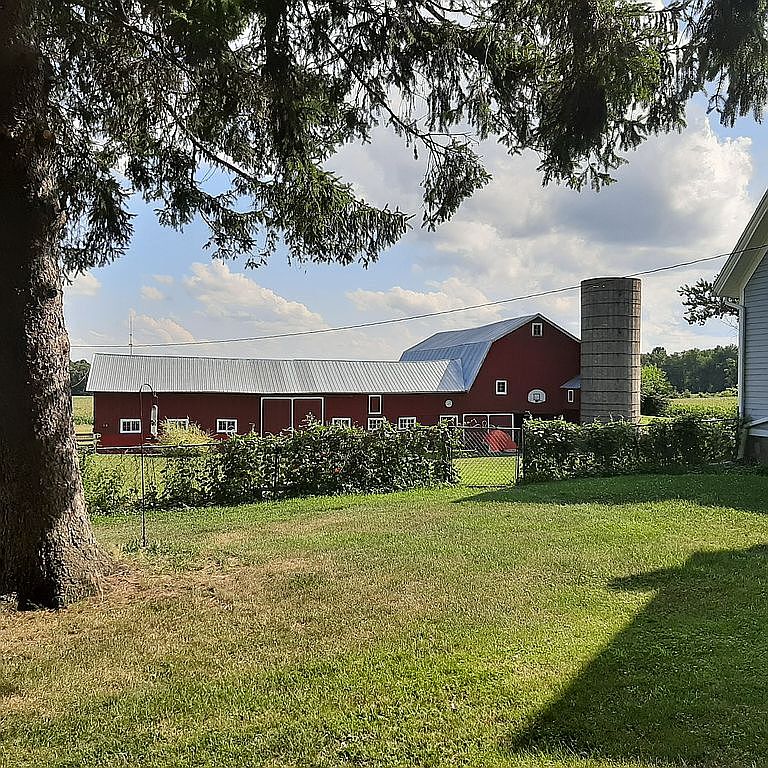
Locate an element on the screen. soffit is located at coordinates (746, 263).